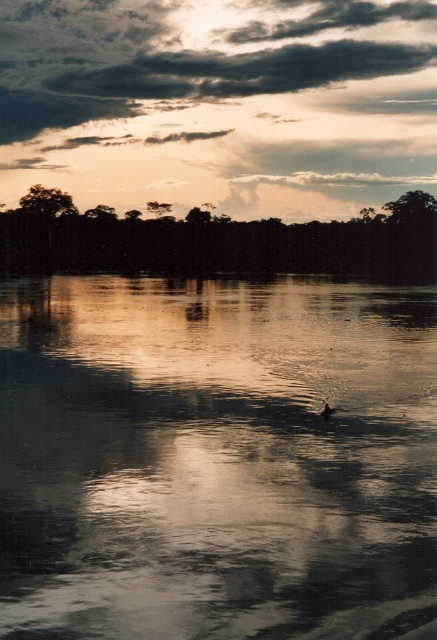
How distant is silvery reflective water at center from cloudy sky at upper center?

silvery reflective water at center and cloudy sky at upper center are 243.24 feet apart.

Does point (149, 624) lie in front of point (232, 157)?

Yes, point (149, 624) is in front of point (232, 157).

Is point (246, 324) positioned after point (225, 40)?

No, it is not.

This screenshot has width=437, height=640. Find the location of `silvery reflective water at center`. silvery reflective water at center is located at coordinates click(215, 458).

Does cloudy sky at upper center have a lesser width compared to brown matte duck at center?

Incorrect, cloudy sky at upper center's width is not less than brown matte duck at center's.

How much distance is there between cloudy sky at upper center and brown matte duck at center?

cloudy sky at upper center and brown matte duck at center are 97.20 meters apart.

Is point (281, 147) positioned after point (326, 404)?

That is True.

Find the location of a particular element. The image size is (437, 640). cloudy sky at upper center is located at coordinates (219, 102).

Which is above, cloudy sky at upper center or green leafy tree at upper left?

cloudy sky at upper center is higher up.

Measure the distance between point [97,166] and camera.

390.26 feet

What are the coordinates of `cloudy sky at upper center` in the screenshot? It's located at (219, 102).

I want to click on cloudy sky at upper center, so point(219,102).